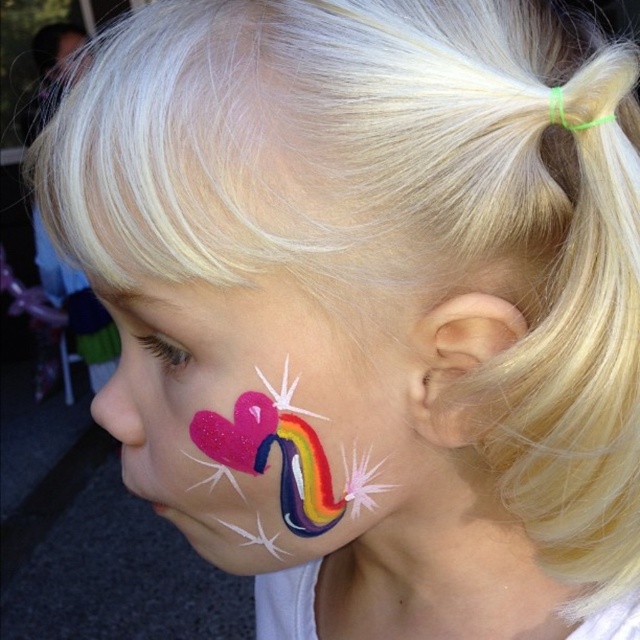
Question: From the image, what is the correct spatial relationship of shiny rainbow heart at lower left in relation to matte pink heart at lower left?

Choices:
 (A) left
 (B) right

Answer: (B)

Question: Which point is farther to the camera?

Choices:
 (A) pink matte ear at right
 (B) matte pink heart at lower left
 (C) shiny rainbow heart at lower left

Answer: (B)

Question: Which of these objects is positioned closest to the matte pink heart at lower left?

Choices:
 (A) shiny pink heart at left
 (B) pink matte ear at right
 (C) shiny rainbow heart at lower left

Answer: (A)

Question: Does shiny pink heart at left come behind matte pink heart at lower left?

Choices:
 (A) no
 (B) yes

Answer: (A)

Question: Does shiny pink heart at left come in front of shiny rainbow heart at lower left?

Choices:
 (A) yes
 (B) no

Answer: (A)

Question: Which object is positioned farthest from the shiny pink heart at left?

Choices:
 (A) shiny rainbow heart at lower left
 (B) matte pink heart at lower left

Answer: (B)